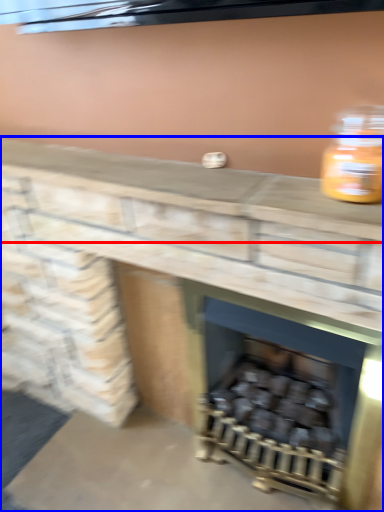
Question: Which object is closer to the camera taking this photo, counter top (highlighted by a red box) or fireplace (highlighted by a blue box)?

Choices:
 (A) counter top
 (B) fireplace

Answer: (B)